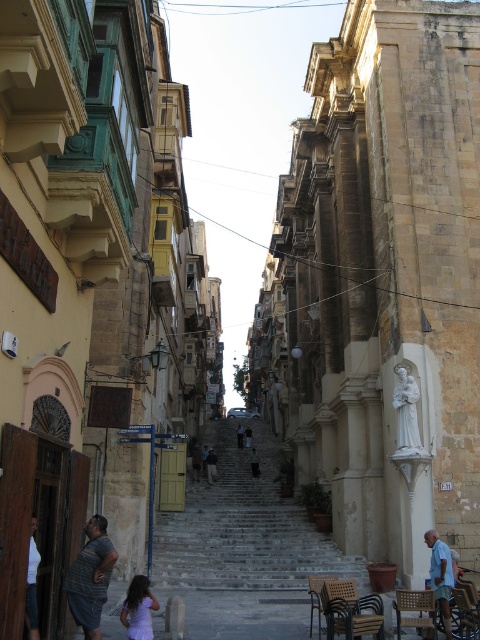
You are a tourist standing at the bottom of the street in the historic European city scene. You see the gray fabric shirt at lower left. If you want to take a photo of it from where you are standing, will you be able to capture it clearly in your camera frame without moving closer?

The gray fabric shirt at lower left is 39.61 meters away from the camera. Since this distance is quite far, it might be challenging to capture it clearly without moving closer, as most cameras require closer proximity for clear details unless using a zoom lens.

You are a photographer standing at the bottom of the street facing the steps. You want to take a photo of the gray fabric shirt at lower left. Your camera has a maximum zoom range of 50 meters. Can you capture the shirt clearly without moving closer?

The gray fabric shirt at lower left and camera are 39.61 meters apart. Since the camera can zoom up to 50 meters, it is within range. Therefore, you can capture the shirt clearly without moving closer.